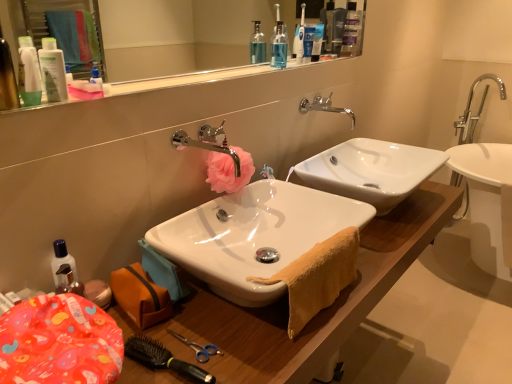
Question: Does matte white lotion at upper left, marked as the first toiletry in a left-to-right arrangement, have a lesser width compared to matte plastic container at lower left?

Choices:
 (A) no
 (B) yes

Answer: (B)

Question: Considering the relative sizes of matte white lotion at upper left, the first toiletry positioned from the bottom, and matte plastic container at lower left in the image provided, is matte white lotion at upper left, the first toiletry positioned from the bottom, smaller than matte plastic container at lower left?

Choices:
 (A) yes
 (B) no

Answer: (A)

Question: Is matte white lotion at upper left, acting as the first toiletry starting from the front, shorter than matte plastic container at lower left?

Choices:
 (A) yes
 (B) no

Answer: (A)

Question: Is matte white lotion at upper left, acting as the first toiletry starting from the front, bigger than matte plastic container at lower left?

Choices:
 (A) yes
 (B) no

Answer: (B)

Question: Is matte white lotion at upper left, the 3th toiletry viewed from the back, turned away from matte plastic container at lower left?

Choices:
 (A) no
 (B) yes

Answer: (A)

Question: From the image's perspective, is white glossy lotion at upper left, the second toiletry in the right-to-left sequence, located above or below matte white lotion at upper left, the first toiletry positioned from the bottom?

Choices:
 (A) above
 (B) below

Answer: (A)

Question: Is white glossy lotion at upper left, the second toiletry in the left-to-right sequence, spatially inside matte white lotion at upper left, acting as the first toiletry starting from the front, or outside of it?

Choices:
 (A) outside
 (B) inside

Answer: (A)

Question: In terms of height, does white glossy lotion at upper left, the second toiletry in the right-to-left sequence, look taller or shorter compared to matte white lotion at upper left, which is the 3th toiletry from right to left?

Choices:
 (A) tall
 (B) short

Answer: (B)

Question: Visually, is white glossy lotion at upper left, the second toiletry in the right-to-left sequence, positioned to the left or to the right of matte white lotion at upper left, the 3th toiletry viewed from the back?

Choices:
 (A) right
 (B) left

Answer: (A)

Question: Which is correct: white plastic toothbrush at upper center is inside transparent plastic mouthwash at upper center, or outside of it?

Choices:
 (A) outside
 (B) inside

Answer: (A)

Question: Does point (302, 43) appear closer or farther from the camera than point (285, 61)?

Choices:
 (A) farther
 (B) closer

Answer: (A)

Question: From the image's perspective, is white plastic toothbrush at upper center positioned above or below transparent plastic mouthwash at upper center?

Choices:
 (A) below
 (B) above

Answer: (B)

Question: From a real-world perspective, relative to transparent plastic mouthwash at upper center, is white plastic toothbrush at upper center vertically above or below?

Choices:
 (A) below
 (B) above

Answer: (B)

Question: Is white plastic toothpaste tube at upper center, the third toiletry from the bottom, wider or thinner than pink fabric flower at center?

Choices:
 (A) thin
 (B) wide

Answer: (A)

Question: From a real-world perspective, relative to pink fabric flower at center, is white plastic toothpaste tube at upper center, which is the 3th toiletry from front to back, vertically above or below?

Choices:
 (A) above
 (B) below

Answer: (A)